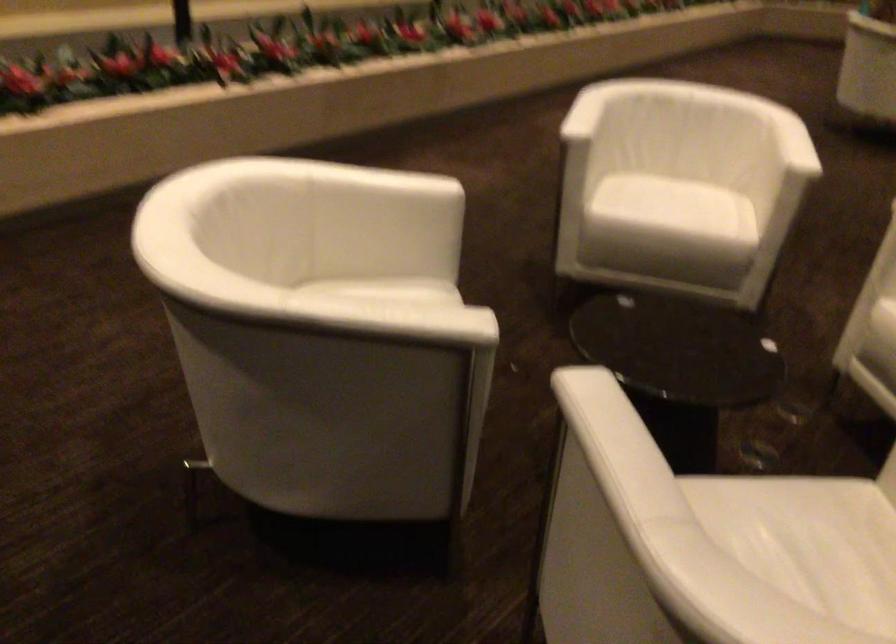
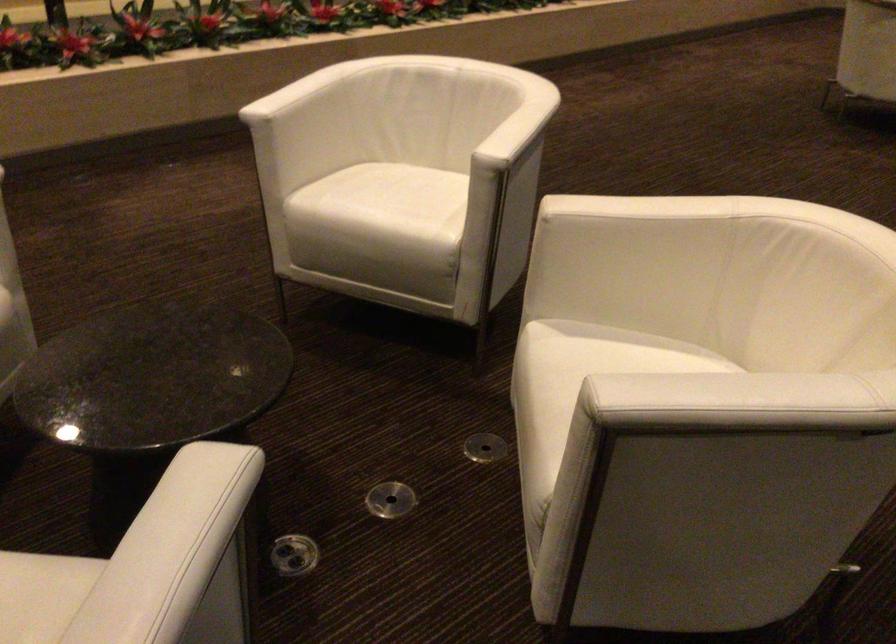
Where in the second image is the point corresponding to point 673,204 from the first image?

(383, 205)